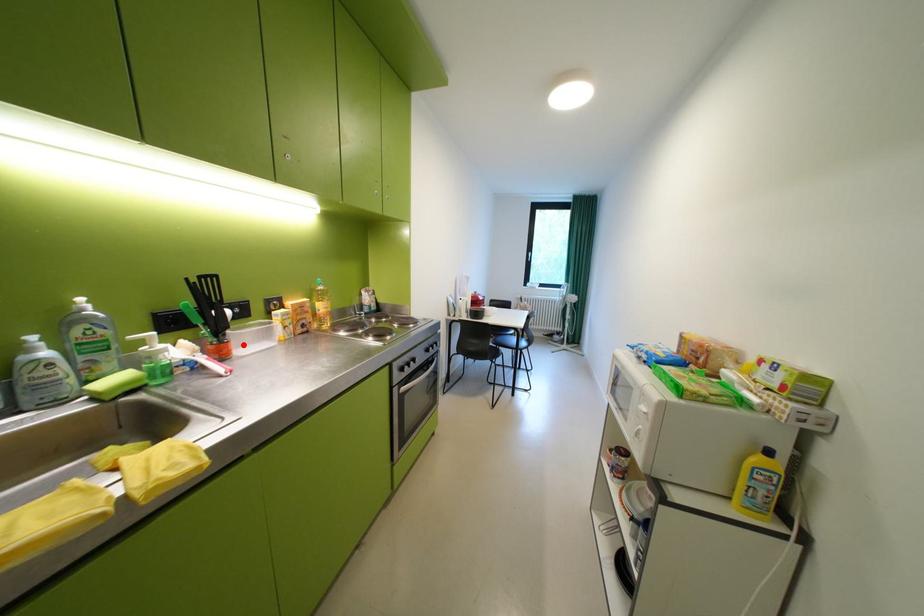
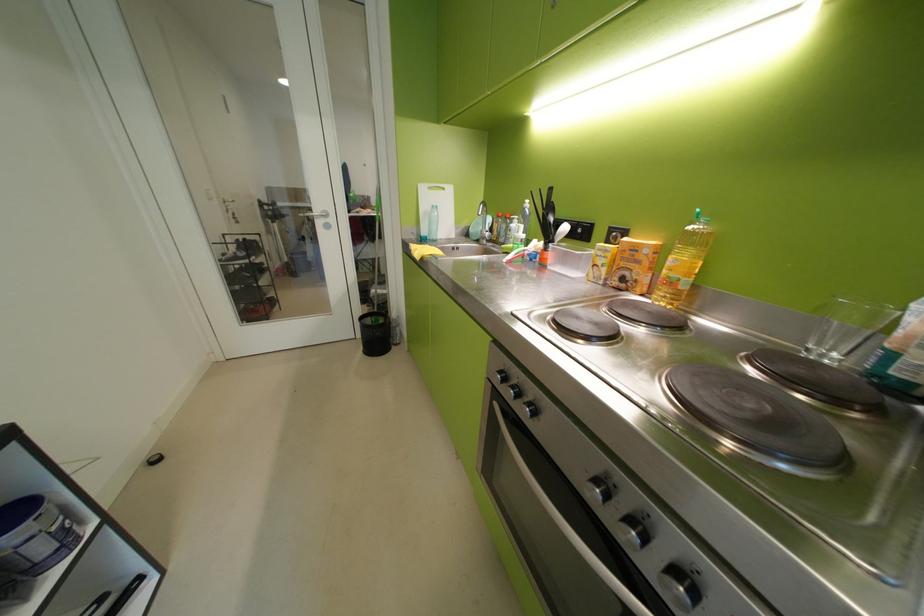
Question: I am providing you with two images of the same scene from different viewpoints. A red point is marked on the first image. At the location where the point appears in image 1, is it still visible in image 2?

Choices:
 (A) Yes
 (B) No

Answer: (A)